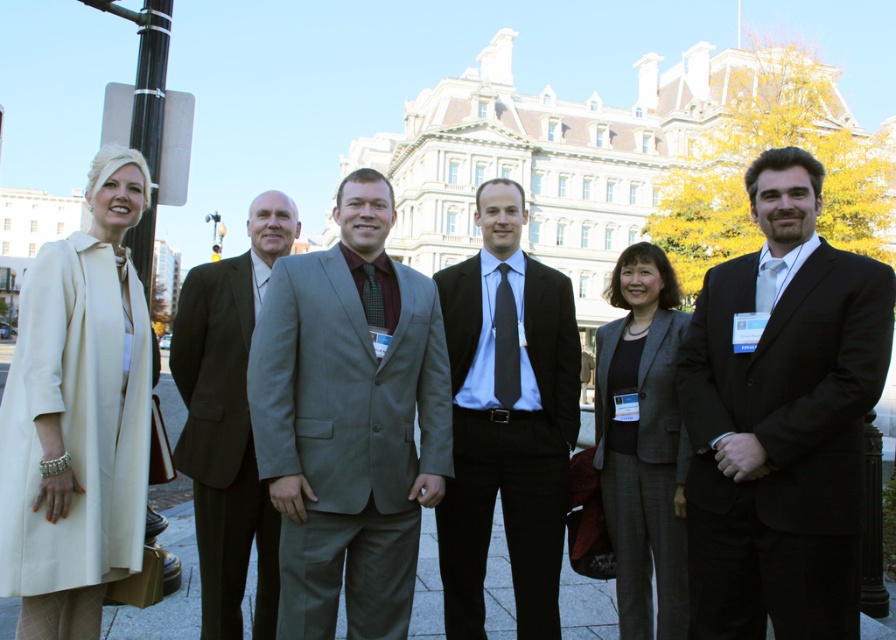
Who is taller, gray suit at center or black smooth suit at center?

black smooth suit at center is taller.

The height and width of the screenshot is (640, 896). In order to click on gray suit at center in this screenshot , I will do `click(349, 420)`.

Where is `gray suit at center`? The image size is (896, 640). gray suit at center is located at coordinates (349, 420).

Between point (733, 316) and point (346, 404), which one is positioned behind?

Positioned behind is point (733, 316).

Is the position of black suit at center more distant than that of gray suit at center?

No, it is not.

Is point (793, 593) behind point (358, 220)?

No, (793, 593) is closer to viewer.

Where is `black suit at center`? The width and height of the screenshot is (896, 640). black suit at center is located at coordinates (781, 419).

Is gray suit at center closer to the viewer compared to dark brown suit at center?

Yes, gray suit at center is closer to the viewer.

Is gray suit at center above dark brown suit at center?

Yes, gray suit at center is above dark brown suit at center.

Is point (442, 481) closer to viewer compared to point (202, 307)?

Yes.

Locate an element on the screen. This screenshot has width=896, height=640. gray suit at center is located at coordinates (349, 420).